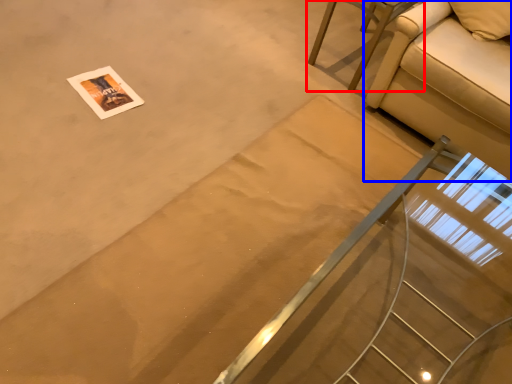
Question: Which point is closer to the camera, furniture (highlighted by a red box) or studio couch (highlighted by a blue box)?

Choices:
 (A) furniture
 (B) studio couch

Answer: (B)